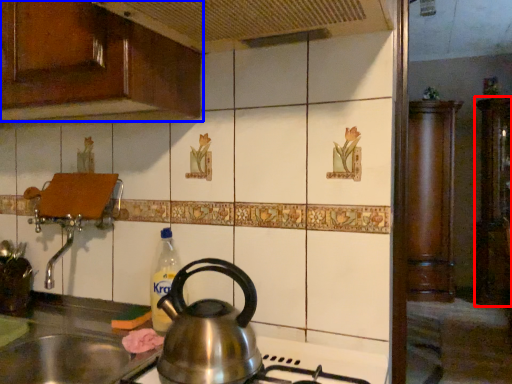
Question: Which object appears farthest to the camera in this image, cabinetry (highlighted by a red box) or cabinetry (highlighted by a blue box)?

Choices:
 (A) cabinetry
 (B) cabinetry

Answer: (A)